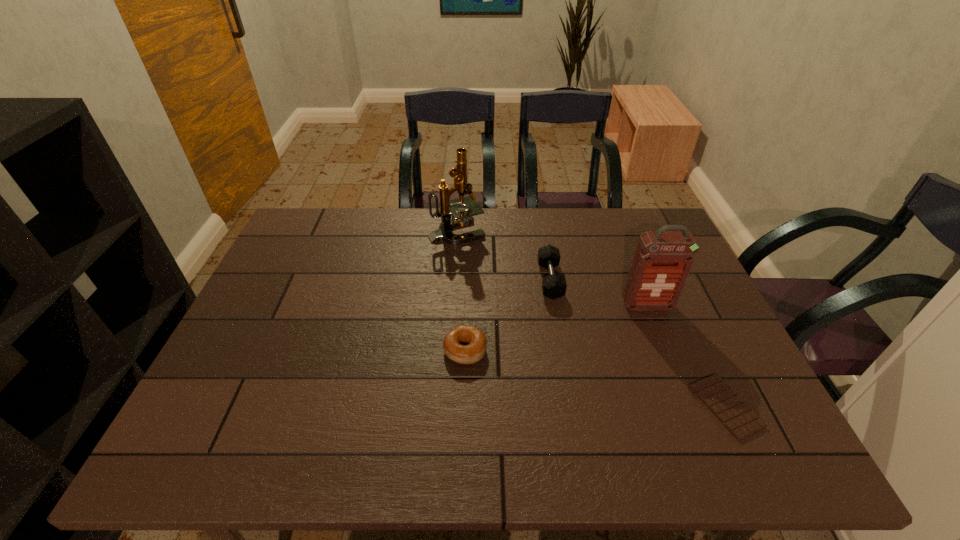
Locate an element on the screen. The image size is (960, 540). vacant space located on the left of the dumbbell is located at coordinates (502, 280).

Locate an element on the screen. This screenshot has height=540, width=960. vacant position located on the back of the second shortest object is located at coordinates (467, 287).

The height and width of the screenshot is (540, 960). Find the location of `vacant space located 0.380m on the left of the nearest object`. vacant space located 0.380m on the left of the nearest object is located at coordinates (525, 406).

This screenshot has height=540, width=960. I want to click on object located at the far edge, so click(x=462, y=217).

I want to click on object that is at the near edge, so click(741, 421).

Where is `the first-aid kit present at the right edge`? The width and height of the screenshot is (960, 540). the first-aid kit present at the right edge is located at coordinates (663, 259).

Where is `chocolate bar present at the right edge`? This screenshot has height=540, width=960. chocolate bar present at the right edge is located at coordinates (741, 421).

Locate an element on the screen. The height and width of the screenshot is (540, 960). object situated at the near right corner is located at coordinates (741, 421).

The image size is (960, 540). What are the coordinates of `free point at the far edge` in the screenshot? It's located at (563, 241).

At what (x,y) coordinates should I click in order to perform the action: click on free space at the near edge. Please return your answer as a coordinate pair (x, y). The image size is (960, 540). Looking at the image, I should click on (617, 444).